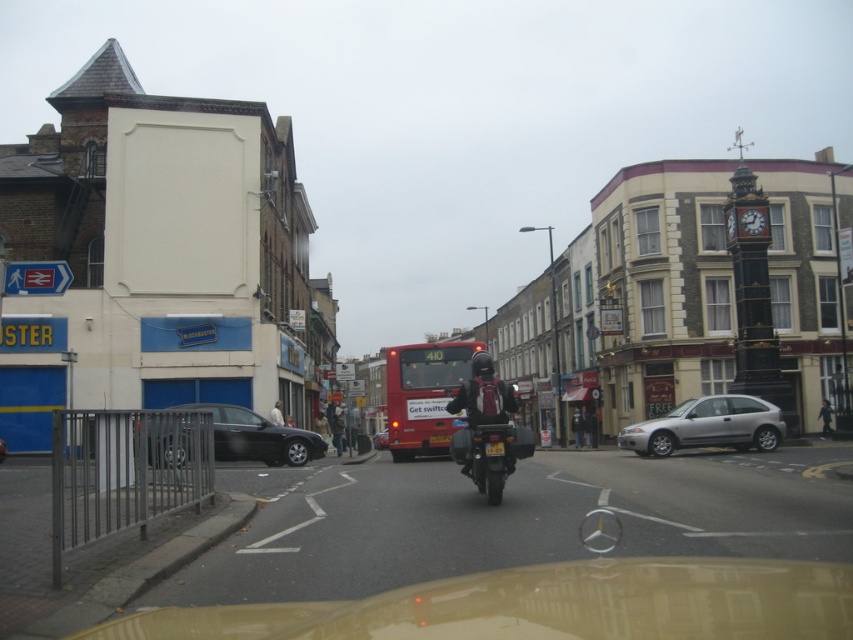
Is gold metallic car at lower center thinner than silver metallic hatchback at center-right?

Yes.

Is gold metallic car at lower center above silver metallic hatchback at center-right?

Yes, gold metallic car at lower center is above silver metallic hatchback at center-right.

Identify the location of gold metallic car at lower center. The height and width of the screenshot is (640, 853). (546, 605).

Is point (331, 628) positioned before point (421, 424)?

Yes, point (331, 628) is in front of point (421, 424).

Can you confirm if gold metallic car at lower center is smaller than red matte bus at center?

Yes.

Between point (294, 611) and point (419, 372), which one is positioned behind?

The point (419, 372) is behind.

This screenshot has width=853, height=640. What are the coordinates of `gold metallic car at lower center` in the screenshot? It's located at (546, 605).

Who is taller, silver metallic hatchback at center-right or shiny black motorcycle at center?

shiny black motorcycle at center is taller.

Is silver metallic hatchback at center-right below shiny black motorcycle at center?

Yes.

Between point (747, 412) and point (451, 445), which one is positioned behind?

The point (747, 412) is more distant.

Identify the location of silver metallic hatchback at center-right. (706, 426).